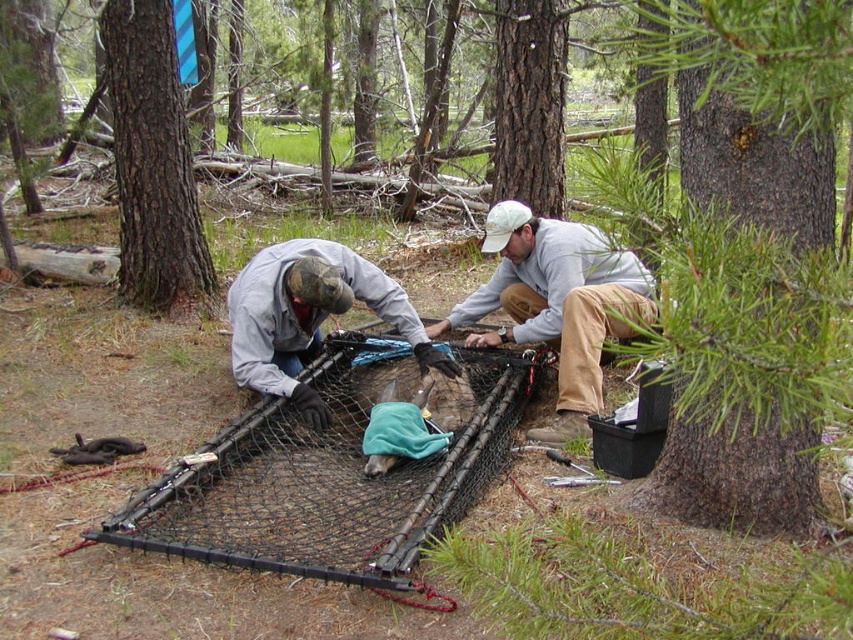
What do you see at coordinates (752, 256) in the screenshot? Image resolution: width=853 pixels, height=640 pixels. I see `green needle-like leaves at center` at bounding box center [752, 256].

Which is behind, point (706, 36) or point (454, 477)?

The point (454, 477) is behind.

Does point (740, 273) come closer to viewer compared to point (157, 540)?

Yes, point (740, 273) is in front of point (157, 540).

I want to click on green needle-like leaves at center, so click(752, 256).

Is point (222, 532) behind point (302, 253)?

No, (222, 532) is in front of (302, 253).

How distant is black mesh net at center from camouflage fabric hat at center?

black mesh net at center is 18.22 inches away from camouflage fabric hat at center.

Who is more distant from viewer, (402, 486) or (286, 374)?

Point (286, 374)

Where is `black mesh net at center`? black mesh net at center is located at coordinates (328, 480).

Who is higher up, green needle-like leaves at center or brown rough bark tree at center?

Positioned higher is brown rough bark tree at center.

Can you confirm if green needle-like leaves at center is smaller than brown rough bark tree at center?

Incorrect, green needle-like leaves at center is not smaller in size than brown rough bark tree at center.

Where is `green needle-like leaves at center`? Image resolution: width=853 pixels, height=640 pixels. green needle-like leaves at center is located at coordinates (752, 256).

You are a GUI agent. You are given a task and a screenshot of the screen. Output one action in this format:
    pyautogui.click(x=<x>, y=<y>)
    Task: Click on the green needle-like leaves at center
    The image size is (853, 640).
    Given the screenshot: What is the action you would take?
    pyautogui.click(x=752, y=256)